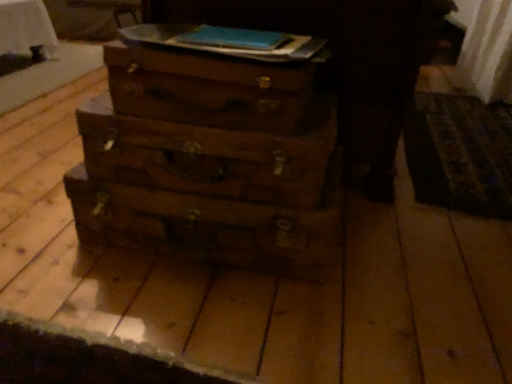
Question: Is wooden drawer at center, which is the third drawer in top-to-bottom order, positioned beyond the bounds of wooden drawer at center, arranged as the second drawer when ordered from the bottom?

Choices:
 (A) no
 (B) yes

Answer: (B)

Question: Can you confirm if wooden drawer at center, which is the third drawer in top-to-bottom order, is shorter than wooden drawer at center, arranged as the second drawer when ordered from the bottom?

Choices:
 (A) yes
 (B) no

Answer: (A)

Question: Is wooden drawer at center, arranged as the second drawer when ordered from the bottom, a part of wooden drawer at center, which is the third drawer in top-to-bottom order?

Choices:
 (A) no
 (B) yes

Answer: (A)

Question: Considering the relative sizes of wooden drawer at center, which is the third drawer in top-to-bottom order, and wooden drawer at center, arranged as the second drawer when ordered from the bottom, in the image provided, is wooden drawer at center, which is the third drawer in top-to-bottom order, thinner than wooden drawer at center, arranged as the second drawer when ordered from the bottom,?

Choices:
 (A) yes
 (B) no

Answer: (B)

Question: From a real-world perspective, is wooden drawer at center, which is the third drawer in top-to-bottom order, positioned under wooden drawer at center, arranged as the second drawer when ordered from the bottom, based on gravity?

Choices:
 (A) no
 (B) yes

Answer: (B)

Question: Is wooden drawer at center, the first drawer when ordered from bottom to top, situated inside wooden chest at center or outside?

Choices:
 (A) outside
 (B) inside

Answer: (A)

Question: In terms of width, does wooden drawer at center, the first drawer when ordered from bottom to top, look wider or thinner when compared to wooden chest at center?

Choices:
 (A) wide
 (B) thin

Answer: (B)

Question: From a real-world perspective, is wooden drawer at center, the first drawer when ordered from bottom to top, above or below wooden chest at center?

Choices:
 (A) above
 (B) below

Answer: (B)

Question: Considering their positions, is wooden drawer at center, which is the third drawer in top-to-bottom order, located in front of or behind wooden chest at center?

Choices:
 (A) front
 (B) behind

Answer: (A)

Question: In terms of height, does wooden drawer at center, acting as the 1th drawer starting from the top, look taller or shorter compared to wooden chest at center?

Choices:
 (A) tall
 (B) short

Answer: (B)

Question: Is wooden drawer at center, positioned as the third drawer in bottom-to-top order, to the left or to the right of wooden chest at center in the image?

Choices:
 (A) left
 (B) right

Answer: (A)

Question: From a real-world perspective, is wooden drawer at center, positioned as the third drawer in bottom-to-top order, physically located above or below wooden chest at center?

Choices:
 (A) below
 (B) above

Answer: (B)

Question: Does point (309, 102) appear closer or farther from the camera than point (335, 67)?

Choices:
 (A) farther
 (B) closer

Answer: (B)

Question: Based on their sizes in the image, would you say wooden drawer at center, which is the third drawer in top-to-bottom order, is bigger or smaller than wooden drawer at center, marked as the 2th drawer in a top-to-bottom arrangement?

Choices:
 (A) big
 (B) small

Answer: (A)

Question: Is wooden drawer at center, the first drawer when ordered from bottom to top, inside the boundaries of wooden drawer at center, marked as the 2th drawer in a top-to-bottom arrangement, or outside?

Choices:
 (A) outside
 (B) inside

Answer: (A)